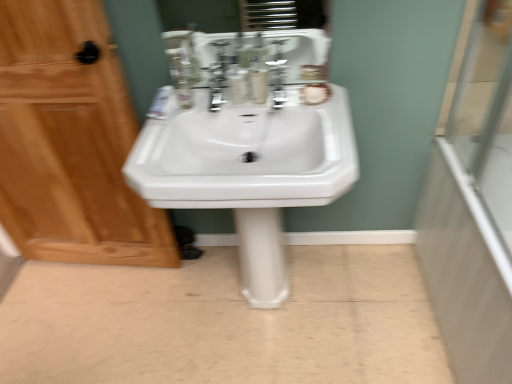
The width and height of the screenshot is (512, 384). Find the location of `vacant area that is in front of wooden cabinet at left`. vacant area that is in front of wooden cabinet at left is located at coordinates (93, 324).